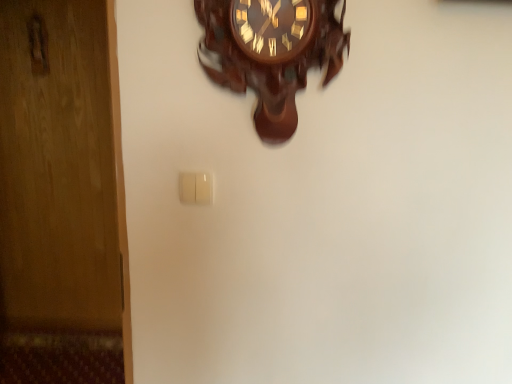
Question: Considering the positions of white plastic light switch at center and wooden wall clock at upper center in the image, is white plastic light switch at center wider or thinner than wooden wall clock at upper center?

Choices:
 (A) wide
 (B) thin

Answer: (B)

Question: From their relative heights in the image, would you say white plastic light switch at center is taller or shorter than wooden wall clock at upper center?

Choices:
 (A) tall
 (B) short

Answer: (B)

Question: In terms of size, does white plastic light switch at center appear bigger or smaller than wooden wall clock at upper center?

Choices:
 (A) big
 (B) small

Answer: (B)

Question: Is point (322, 34) positioned closer to the camera than point (207, 198)?

Choices:
 (A) farther
 (B) closer

Answer: (B)

Question: In the image, is wooden wall clock at upper center on the left side or the right side of white plastic light switch at center?

Choices:
 (A) left
 (B) right

Answer: (B)

Question: Is wooden wall clock at upper center bigger or smaller than white plastic light switch at center?

Choices:
 (A) big
 (B) small

Answer: (A)

Question: In the image, is wooden wall clock at upper center positioned in front of or behind white plastic light switch at center?

Choices:
 (A) front
 (B) behind

Answer: (A)